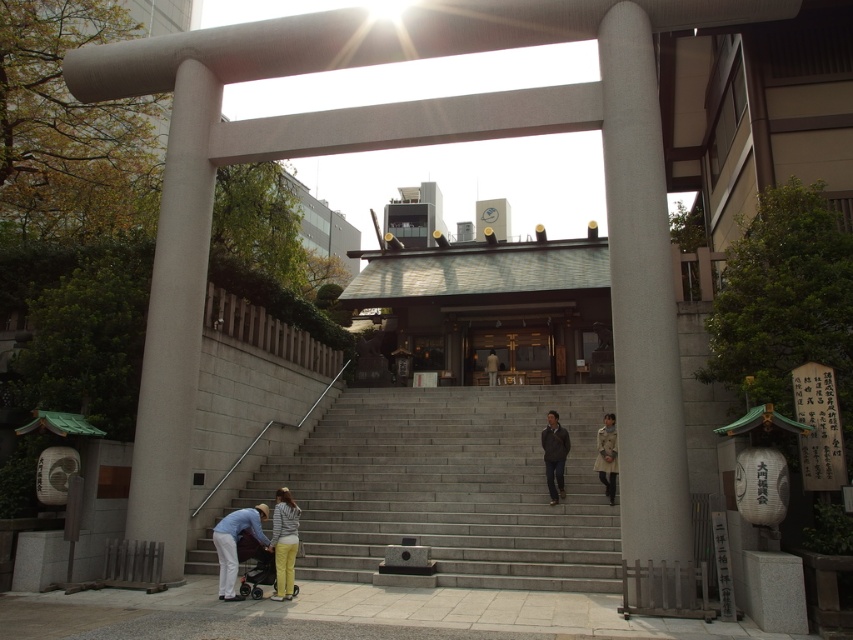
Question: Is dark gray jacket at center to the left of light brown leather jacket at center from the viewer's perspective?

Choices:
 (A) yes
 (B) no

Answer: (B)

Question: Which of the following is the closest to the observer?

Choices:
 (A) (635, 209)
 (B) (294, 518)
 (C) (521, 326)

Answer: (B)

Question: Which point appears farthest from the camera in this image?

Choices:
 (A) (274, 593)
 (B) (490, 381)
 (C) (612, 467)
 (D) (294, 536)

Answer: (B)

Question: Does light brown leather coat at center appear on the left side of light brown leather jacket at center?

Choices:
 (A) yes
 (B) no

Answer: (B)

Question: Which object is closer to the camera taking this photo?

Choices:
 (A) wooden door at center
 (B) white concrete pillar at right
 (C) light brown leather jacket at center
 (D) light brown leather coat at center

Answer: (B)

Question: Can you confirm if wooden door at center is positioned above light gray fabric pants at lower center?

Choices:
 (A) no
 (B) yes

Answer: (B)